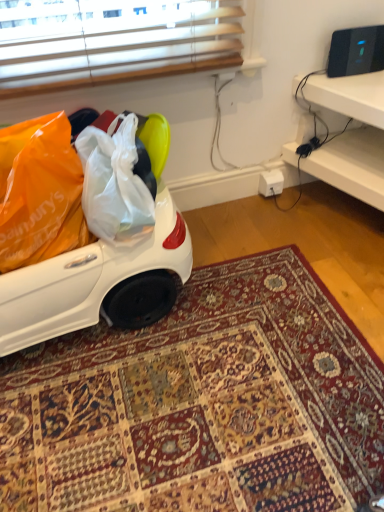
The width and height of the screenshot is (384, 512). I want to click on white plastic desk at right, so click(351, 135).

This screenshot has width=384, height=512. What do you see at coordinates (351, 135) in the screenshot? I see `white plastic desk at right` at bounding box center [351, 135].

Where is `carpeted rug at center`? carpeted rug at center is located at coordinates (201, 404).

What do you see at coordinates (201, 404) in the screenshot?
I see `carpeted rug at center` at bounding box center [201, 404].

Where is `white plastic desk at right`? white plastic desk at right is located at coordinates (351, 135).

Between carpeted rug at center and white plastic desk at right, which one appears on the right side from the viewer's perspective?

white plastic desk at right is more to the right.

Is carpeted rug at center positioned in front of white plastic desk at right?

Yes, the depth of carpeted rug at center is less than that of white plastic desk at right.

Between point (193, 474) and point (334, 86), which one is positioned behind?

The point (334, 86) is farther.

From the image's perspective, is carpeted rug at center beneath white plastic desk at right?

Yes, from the image's perspective, carpeted rug at center is below white plastic desk at right.

From a real-world perspective, which is physically below, carpeted rug at center or white plastic desk at right?

carpeted rug at center is physically lower.

Which of these two, carpeted rug at center or white plastic desk at right, is thinner?

With smaller width is white plastic desk at right.

Can you confirm if carpeted rug at center is shorter than white plastic desk at right?

Indeed, carpeted rug at center has a lesser height compared to white plastic desk at right.

Who is smaller, carpeted rug at center or white plastic desk at right?

Smaller between the two is carpeted rug at center.

Is carpeted rug at center not within white plastic desk at right?

carpeted rug at center lies outside white plastic desk at right's area.

Are carpeted rug at center and white plastic desk at right beside each other?

No, carpeted rug at center is not touching white plastic desk at right.

Is white plastic desk at right at the back of carpeted rug at center?

That's not correct — carpeted rug at center is not looking away from white plastic desk at right.

Looking at this image, how much distance is there between carpeted rug at center and white plastic desk at right?

carpeted rug at center and white plastic desk at right are 84.93 centimeters apart from each other.

Locate an element on the screen. This screenshot has width=384, height=512. mat below the white plastic desk at right (from the image's perspective) is located at coordinates (201, 404).

Which object is positioned more to the left, white plastic desk at right or carpeted rug at center?

carpeted rug at center is more to the left.

Considering their positions, is white plastic desk at right located in front of or behind carpeted rug at center?

In the image, white plastic desk at right appears behind carpeted rug at center.

Between point (355, 95) and point (376, 457), which one is positioned in front?

The point (376, 457) is more forward.

From the image's perspective, does white plastic desk at right appear higher than carpeted rug at center?

Yes, from the image's perspective, white plastic desk at right is over carpeted rug at center.

From a real-world perspective, who is located higher, white plastic desk at right or carpeted rug at center?

white plastic desk at right.

Can you confirm if white plastic desk at right is thinner than carpeted rug at center?

Yes, white plastic desk at right is thinner than carpeted rug at center.

Considering the sizes of objects white plastic desk at right and carpeted rug at center in the image provided, who is shorter, white plastic desk at right or carpeted rug at center?

carpeted rug at center is shorter.

Is white plastic desk at right bigger or smaller than carpeted rug at center?

white plastic desk at right is bigger than carpeted rug at center.

Looking at this image, is white plastic desk at right not within carpeted rug at center?

Yes.

Is white plastic desk at right next to carpeted rug at center?

No, white plastic desk at right is not beside carpeted rug at center.

Is carpeted rug at center at the back of white plastic desk at right?

No, carpeted rug at center is not at the back of white plastic desk at right.

At what (x,y) coordinates should I click in order to perform the action: click on furniture above the carpeted rug at center (from a real-world perspective). Please return your answer as a coordinate pair (x, y). The width and height of the screenshot is (384, 512). Looking at the image, I should click on (351, 135).

Where is `mat lying in front of the white plastic desk at right`? This screenshot has width=384, height=512. mat lying in front of the white plastic desk at right is located at coordinates (201, 404).

There is a carpeted rug at center. What are the coordinates of `furniture above it (from a real-world perspective)` in the screenshot? It's located at (351, 135).